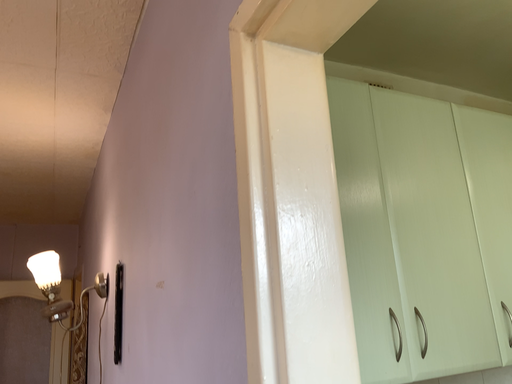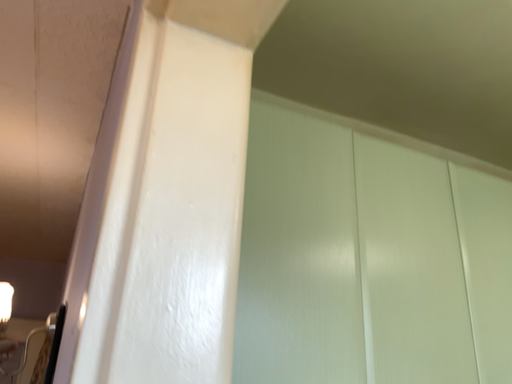
Question: Which way did the camera rotate in the video?

Choices:
 (A) rotated upward
 (B) rotated downward

Answer: (A)